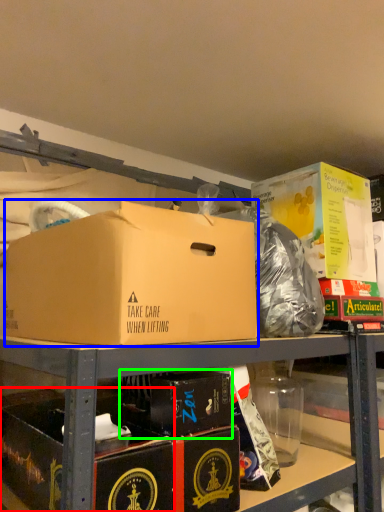
Question: Based on their relative distances, which object is nearer to box (highlighted by a red box)? Choose from box (highlighted by a blue box) and box (highlighted by a green box).

Choices:
 (A) box
 (B) box

Answer: (B)